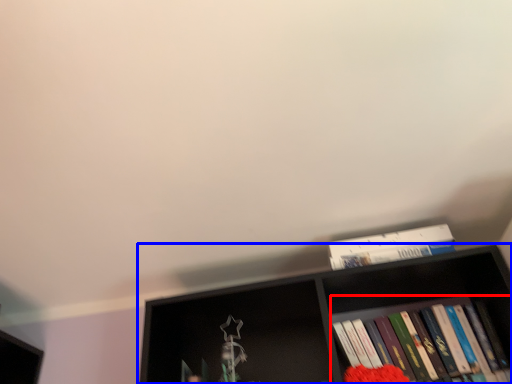
Question: Which of the following is the closest to the observer, book (highlighted by a red box) or shelf (highlighted by a blue box)?

Choices:
 (A) book
 (B) shelf

Answer: (B)